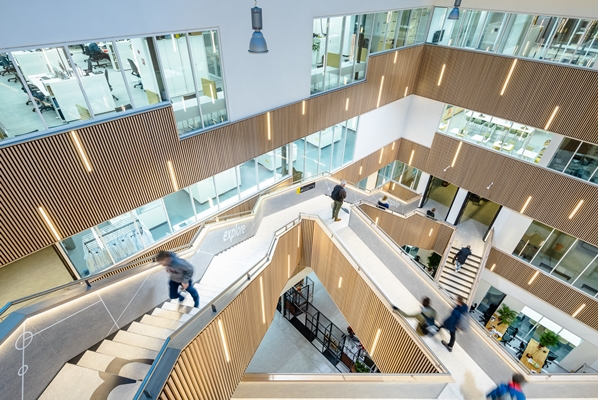
What are the coordinates of `step on stairs` in the screenshot? It's located at (451, 299), (448, 291), (459, 288), (466, 285), (459, 275), (466, 273), (466, 265), (472, 262), (475, 251).